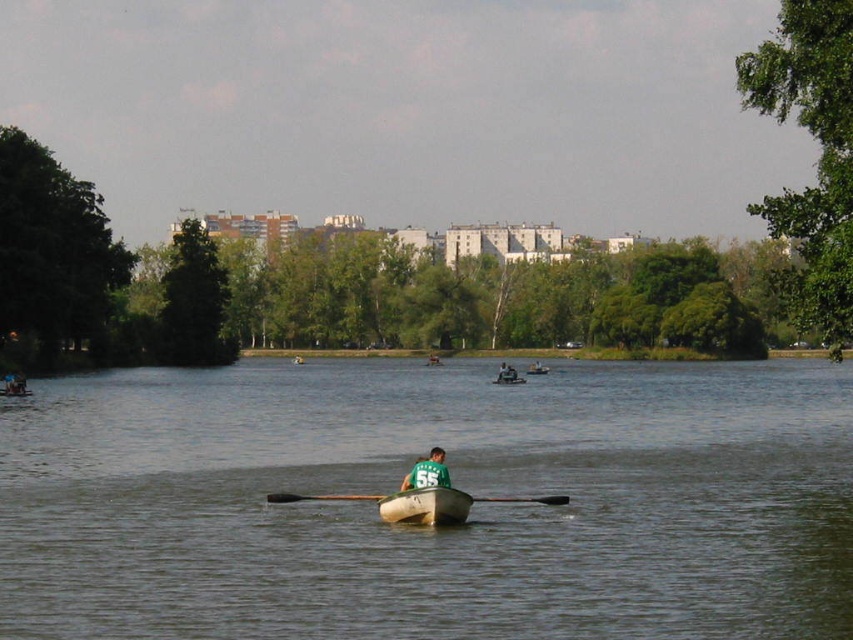
You are standing at the point with coordinates point (512,378) and want to walk to the point with coordinates point (357,497). Which direction should you move to get closer to your destination?

You should move towards the direction of the point (357,497), which is closer to the viewer than point (512,378). Since point (357,497) is closer, moving towards it would mean heading in the direction where the points are nearer in the scene.

You are a photographer trying to capture the wooden smooth paddle at center in the image. The camera you are using has a focal length of 50mm. If the paddle is located at coordinates point 0.778, 0.374, where should you position your camera to ensure the paddle is centered in your shot?

To center the wooden smooth paddle at center in your shot, position your camera so that it aligns with the coordinates point (318, 497) provided in the image.